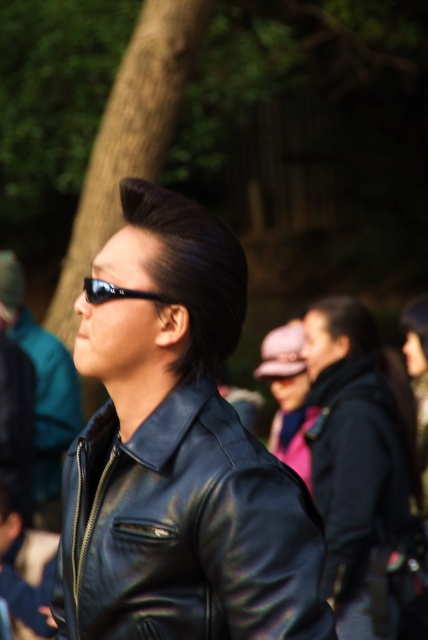
Question: Among these objects, which one is farthest from the camera?

Choices:
 (A) matte black jacket at center
 (B) sunglasses at center
 (C) shiny black jacket at center

Answer: (C)

Question: In this image, where is matte black jacket at center located relative to shiny black jacket at center?

Choices:
 (A) below
 (B) above

Answer: (A)

Question: Is matte black jacket at center to the left of shiny black jacket at center from the viewer's perspective?

Choices:
 (A) no
 (B) yes

Answer: (A)

Question: Which object appears farthest from the camera in this image?

Choices:
 (A) sunglasses at center
 (B) matte black jacket at center
 (C) shiny black jacket at center
 (D) shiny black leather jacket at center

Answer: (C)

Question: Which of the following is the closest to the observer?

Choices:
 (A) (400, 426)
 (B) (198, 586)
 (C) (71, 433)
 (D) (115, 292)

Answer: (B)

Question: Can you confirm if shiny black leather jacket at center is positioned to the right of sunglasses at center?

Choices:
 (A) no
 (B) yes

Answer: (B)